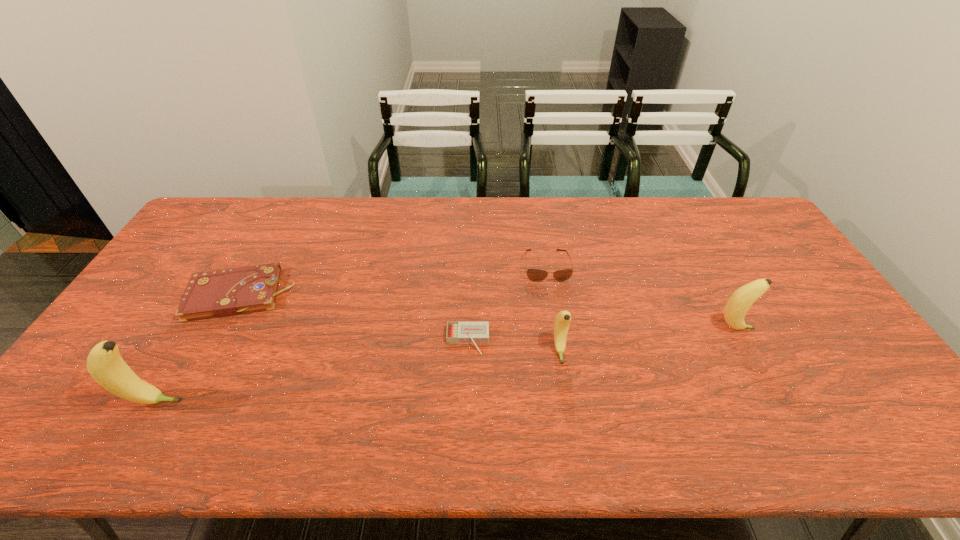
This screenshot has height=540, width=960. I want to click on the tallest object, so click(104, 363).

I want to click on the nearest object, so click(x=104, y=363).

The width and height of the screenshot is (960, 540). What are the coordinates of `the third tallest object` in the screenshot? It's located at (562, 321).

At what (x,y) coordinates should I click in order to perform the action: click on the second banana from left to right. Please return your answer as a coordinate pair (x, y). Looking at the image, I should click on (562, 321).

You are a GUI agent. You are given a task and a screenshot of the screen. Output one action in this format:
    pyautogui.click(x=<x>, y=<y>)
    Task: Click on the rightmost object
    The width and height of the screenshot is (960, 540).
    Given the screenshot: What is the action you would take?
    pyautogui.click(x=739, y=303)

Find the location of a particular element. This screenshot has width=960, height=540. the second shortest banana is located at coordinates (739, 303).

Where is `the fourth tallest object`? The height and width of the screenshot is (540, 960). the fourth tallest object is located at coordinates (536, 275).

The image size is (960, 540). I want to click on the shortest object, so click(x=457, y=332).

Where is `the third object from left to right`? The image size is (960, 540). the third object from left to right is located at coordinates (457, 332).

The image size is (960, 540). I want to click on notebook, so click(x=221, y=293).